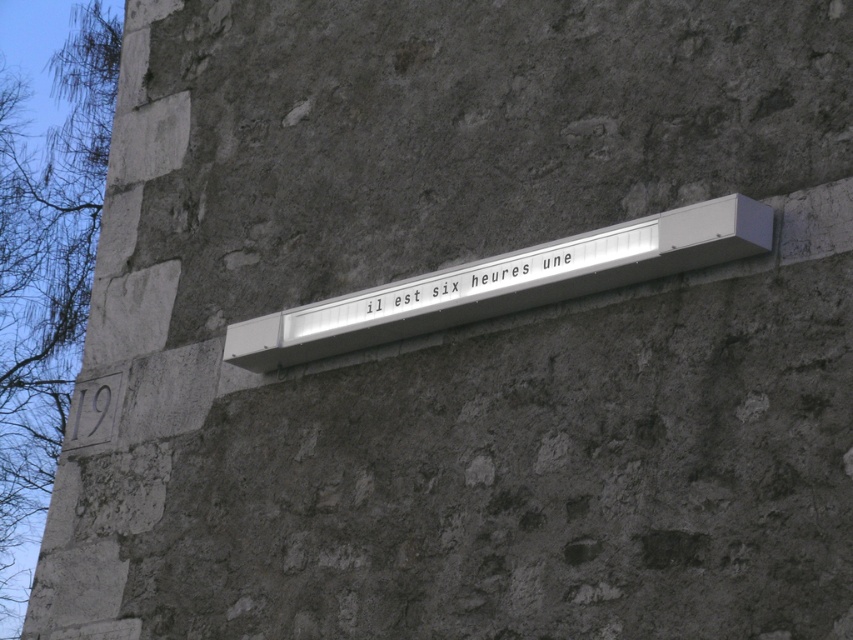
You are standing in front of the stone wall and notice two signs. The first is a white plastic sign at center, and the second is a white metallic sign at center. Which one is positioned lower on the wall?

The white plastic sign at center is located below the white metallic sign at center, so it is positioned lower on the wall.

You are standing in front of a stone wall with two signs. The scene has a white plastic sign at center and a white metallic sign at center. Which sign is positioned more to the right?

The white plastic sign at center is positioned more to the right than the white metallic sign at center.

You are a drone operator trying to navigate between two points on a stone wall. The points are labeled as point 1 at coordinates point (367, 304) and point 2 at coordinates point (363, 320). Given the wall has a modern signboard attached, which point would you fly over first if you are approaching the wall from the front?

Point 1 at coordinates point (367, 304) is behind point 2 at coordinates point (363, 320). Therefore, when approaching the wall from the front, you would encounter point 2 first before reaching point 1.